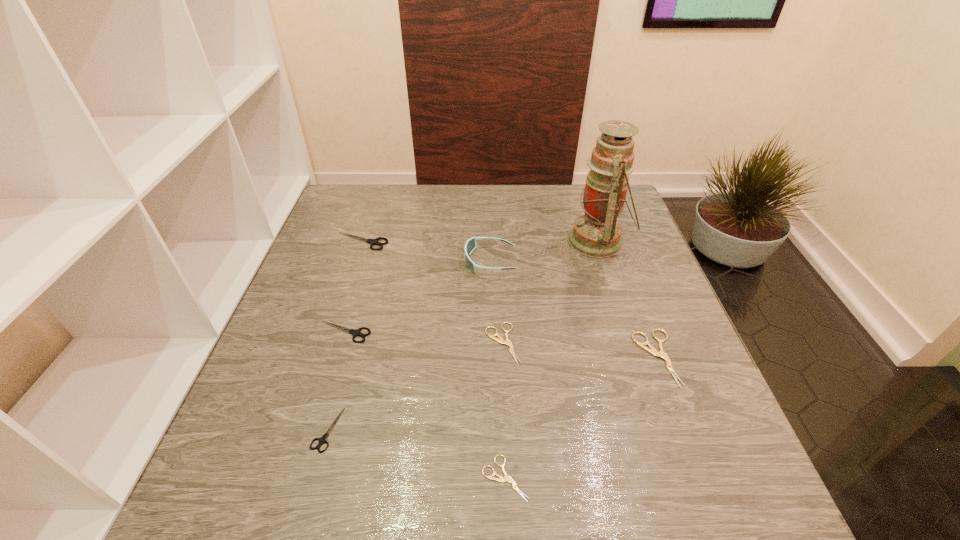
The height and width of the screenshot is (540, 960). I want to click on vacant space located on the right of the second smallest beige shears, so click(575, 343).

This screenshot has height=540, width=960. Identify the location of free space located on the back of the second nearest object. (369, 282).

You are a GUI agent. You are given a task and a screenshot of the screen. Output one action in this format:
    pyautogui.click(x=<x>, y=<y>)
    Task: Click on the free spot located on the right of the shortest shears
    This screenshot has height=540, width=960.
    Given the screenshot: What is the action you would take?
    pyautogui.click(x=726, y=478)

At what (x,y) coordinates should I click in order to perform the action: click on object that is at the far edge. Please return your answer as a coordinate pair (x, y). Looking at the image, I should click on (597, 234).

You are a GUI agent. You are given a task and a screenshot of the screen. Output one action in this format:
    pyautogui.click(x=<x>, y=<y>)
    Task: Click on the object present at the near edge
    The width and height of the screenshot is (960, 540).
    Given the screenshot: What is the action you would take?
    pyautogui.click(x=507, y=478)

This screenshot has height=540, width=960. What are the coordinates of `oil lamp that is at the right edge` in the screenshot? It's located at (597, 234).

Identify the location of shears that is at the right edge. click(652, 350).

Find the location of `object located in the far right corner section of the desktop`. object located in the far right corner section of the desktop is located at coordinates (597, 234).

Identify the location of free space at the far edge. (465, 200).

At what (x,y) coordinates should I click in order to perform the action: click on vacant space at the near edge. Please return your answer as a coordinate pair (x, y). This screenshot has height=540, width=960. Looking at the image, I should click on (495, 528).